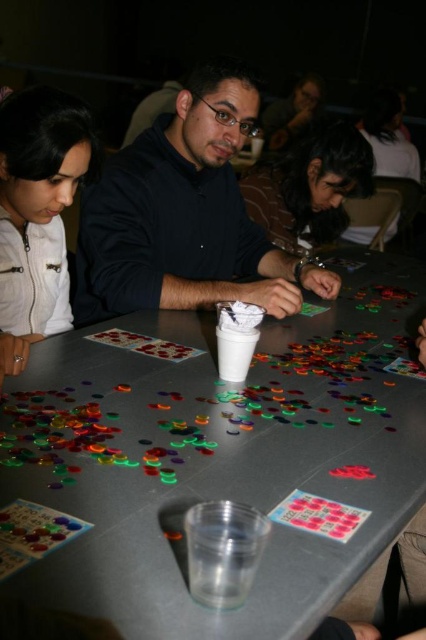
Between translucent plastic table at center and dark brown hair at center, which one has less height?

dark brown hair at center

Does point (340, 564) lie behind point (270, 170)?

No.

Is point (394, 289) farther from camera compared to point (328, 230)?

No, it is in front of (328, 230).

Locate an element on the screen. This screenshot has height=640, width=426. translucent plastic table at center is located at coordinates pyautogui.click(x=221, y=456).

Locate an element on the screen. matte black shirt at center is located at coordinates (184, 216).

Measure the distance between matte black shirt at center and camera.

matte black shirt at center and camera are 4.20 feet apart from each other.

The image size is (426, 640). I want to click on matte black shirt at center, so click(x=184, y=216).

Which is below, matte black shirt at center or matte white jacket at upper left?

matte white jacket at upper left

Does matte black shirt at center appear on the right side of matte white jacket at upper left?

Correct, you'll find matte black shirt at center to the right of matte white jacket at upper left.

Image resolution: width=426 pixels, height=640 pixels. What do you see at coordinates (184, 216) in the screenshot?
I see `matte black shirt at center` at bounding box center [184, 216].

The image size is (426, 640). I want to click on matte black shirt at center, so click(x=184, y=216).